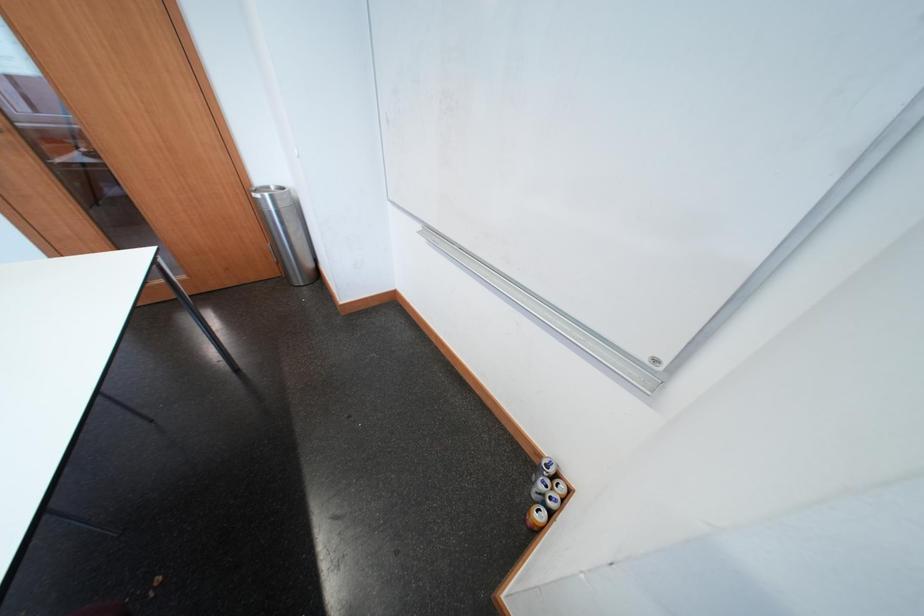
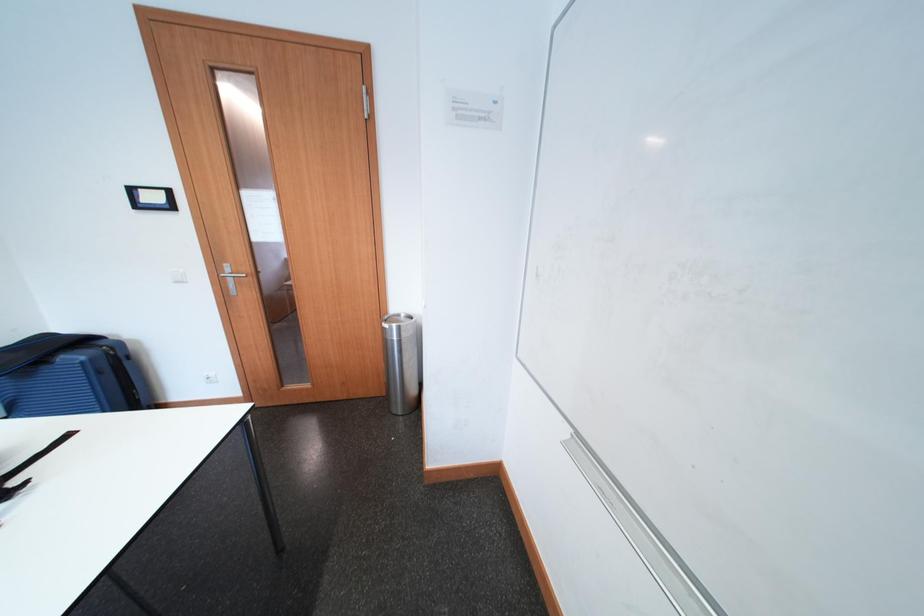
First-person continuous shooting, in which direction is the camera rotating?

The camera rotated toward left-up.